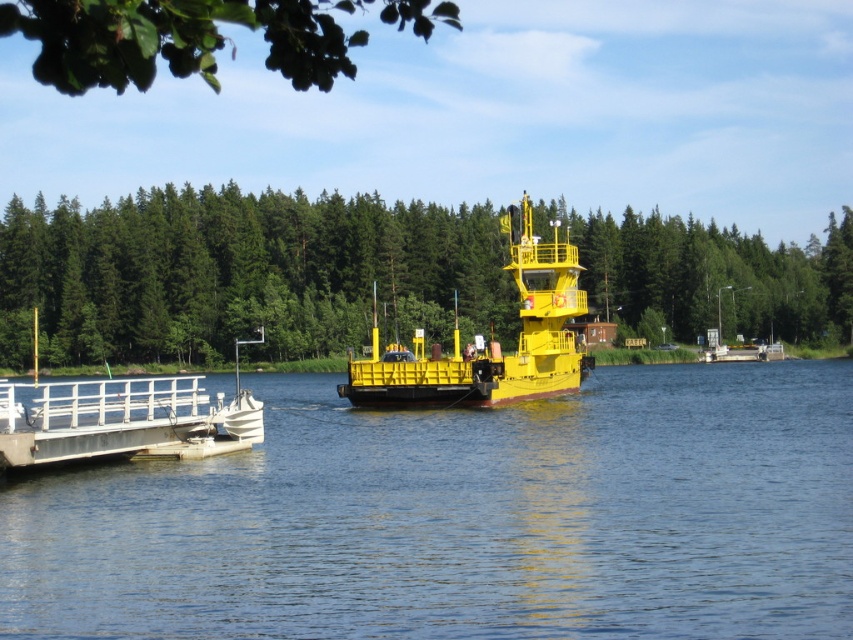
Question: Which point is farther from the camera taking this photo?

Choices:
 (A) (524, 273)
 (B) (115, 321)
 (C) (138, 60)
 (D) (48, 413)

Answer: (B)

Question: Among these objects, which one is farthest from the camera?

Choices:
 (A) white matte dock at lower left
 (B) green leafy branch at upper left
 (C) blue water at center
 (D) yellow matte boat at center

Answer: (D)

Question: Which is farther from the green leafy branch at upper left?

Choices:
 (A) yellow matte boat at center
 (B) blue water at center
 (C) green leafy trees at center

Answer: (B)

Question: Does blue water at center have a lesser width compared to green leafy trees at center?

Choices:
 (A) yes
 (B) no

Answer: (A)

Question: Can you confirm if blue water at center is positioned above white matte dock at lower left?

Choices:
 (A) yes
 (B) no

Answer: (B)

Question: From the image, what is the correct spatial relationship of yellow matte boat at center in relation to white matte dock at lower left?

Choices:
 (A) above
 (B) below

Answer: (A)